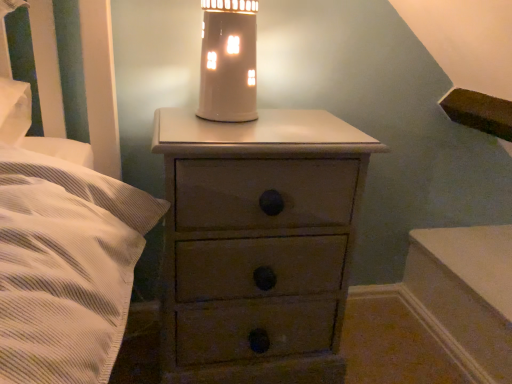
The height and width of the screenshot is (384, 512). I want to click on vacant area on top of matte brown chest of drawers at center (from a real-world perspective), so click(x=262, y=124).